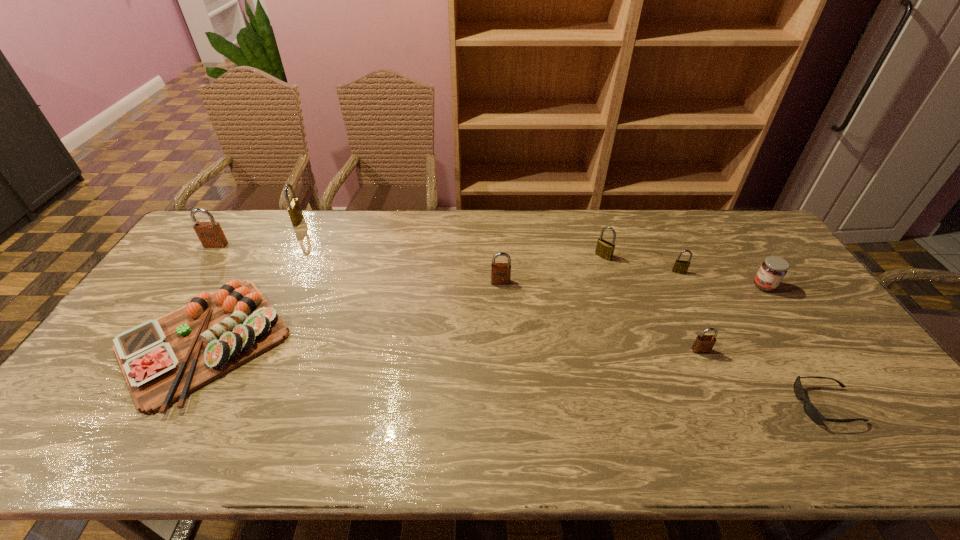
Image resolution: width=960 pixels, height=540 pixels. I want to click on sunglasses that is at the right edge, so click(811, 411).

Identify the location of object that is positioned at the far left corner. The width and height of the screenshot is (960, 540). (210, 234).

Where is `object located at the near right corner`? object located at the near right corner is located at coordinates (811, 411).

Identify the location of free space at the far edge. The image size is (960, 540). (408, 244).

Image resolution: width=960 pixels, height=540 pixels. Identify the location of free space at the near edge of the desktop. (664, 457).

Locate an element on the screen. Image resolution: width=960 pixels, height=540 pixels. vacant space at the far right corner of the desktop is located at coordinates click(751, 231).

This screenshot has height=540, width=960. I want to click on free space between the nearest brass padlock and the second shortest object, so click(442, 306).

Identify the location of vacant area that lies between the platter and the shortest object. (516, 373).

The height and width of the screenshot is (540, 960). Find the location of `free space between the fifth nearest padlock and the fourth object from left to right`. free space between the fifth nearest padlock and the fourth object from left to right is located at coordinates (358, 264).

Where is `free area in between the fourth padlock from right to left and the eighth tallest object`? This screenshot has width=960, height=540. free area in between the fourth padlock from right to left and the eighth tallest object is located at coordinates (352, 312).